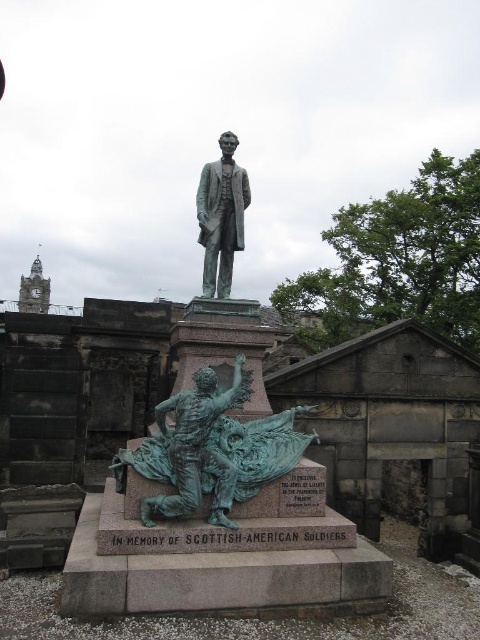
You are a tour guide leading a group to the bronze statue at center. You notice the green patina figure at center is blocking the path. Can your group safely walk around it without getting too close? Please explain using the distance provided.

The distance between the green patina figure at center and bronze statue at center is 7.71 meters. Since the green patina figure at center is part of the bronze statue at center, they are actually the same structure. Therefore, there is no obstruction, and the group can approach the bronze statue at center safely.

From the picture: You are standing in the cemetery and want to take a photo of the green patina figure at center. The cemetery has a rule that visitors must stay at least 1 meter away from the statue. If you are currently at point (195, 449), can you take the photo without violating the rule?

The green patina figure at center is located at point (195, 449). Since you are currently at that exact point, you are standing directly at the statue, which is less than the required 1 meter distance. Therefore, you must move back to comply with the rule before taking the photo.

You are a tour guide explaining the memorial to visitors. You point out the green patina figure at center and the bronze statue at center. Which one is smaller in size?

The green patina figure at center is smaller in size compared to the bronze statue at center.